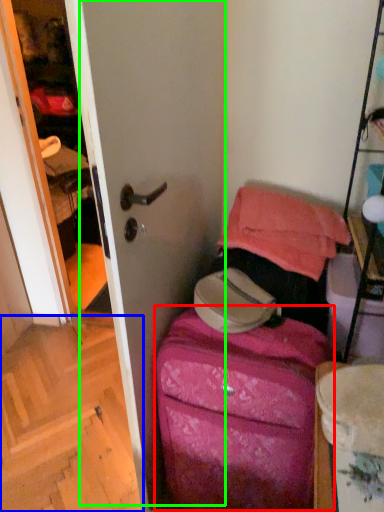
Question: Which object is the closest to the luggage (highlighted by a red box)? Choose among these: stairwell (highlighted by a blue box) or screen door (highlighted by a green box).

Choices:
 (A) stairwell
 (B) screen door

Answer: (B)